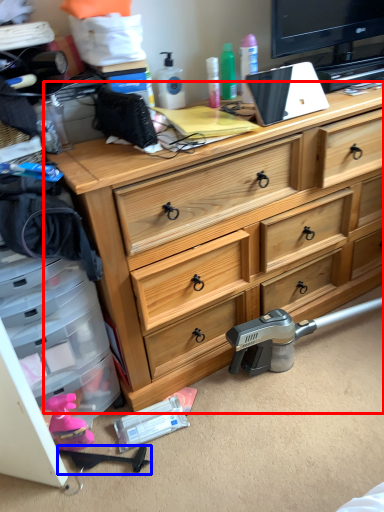
Question: Which object appears farthest to the camera in this image, chest of drawers (highlighted by a red box) or weapon (highlighted by a blue box)?

Choices:
 (A) chest of drawers
 (B) weapon

Answer: (B)